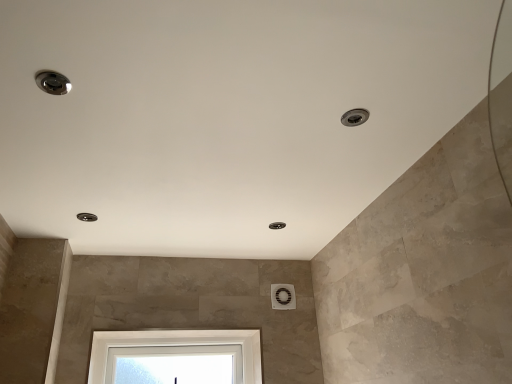
Question: Should I look upward or downward to see matte silver droplight at upper left, positioned as the 1th droplight in left-to-right order?

Choices:
 (A) up
 (B) down

Answer: (B)

Question: Is matte silver droplight at upper left, the 3th droplight viewed from the front, next to satin nickel droplight at upper left, the first droplight viewed from the top?

Choices:
 (A) yes
 (B) no

Answer: (B)

Question: Considering the relative sizes of matte silver droplight at upper left, positioned as the 1th droplight in left-to-right order, and satin nickel droplight at upper left, acting as the second droplight starting from the left, in the image provided, is matte silver droplight at upper left, positioned as the 1th droplight in left-to-right order, smaller than satin nickel droplight at upper left, acting as the second droplight starting from the left,?

Choices:
 (A) yes
 (B) no

Answer: (A)

Question: Can you confirm if matte silver droplight at upper left, positioned as the 1th droplight in left-to-right order, is positioned to the right of satin nickel droplight at upper left, acting as the 3th droplight starting from the back?

Choices:
 (A) no
 (B) yes

Answer: (A)

Question: From a real-world perspective, is matte silver droplight at upper left, which is the 3th droplight in right-to-left order, positioned over satin nickel droplight at upper left, the first droplight viewed from the front, based on gravity?

Choices:
 (A) yes
 (B) no

Answer: (A)

Question: From the image's perspective, does matte silver droplight at upper left, which is the 3th droplight in right-to-left order, appear lower than satin nickel droplight at upper left, the 2th droplight positioned from the right?

Choices:
 (A) no
 (B) yes

Answer: (B)

Question: Could you tell me if matte silver droplight at upper left, the 1th droplight from the back, is facing satin nickel droplight at upper left, acting as the second droplight starting from the left?

Choices:
 (A) no
 (B) yes

Answer: (B)

Question: Can you confirm if satin nickel droplight at upper left, the first droplight viewed from the top, is positioned to the left of matte silver droplight at upper left, the 1th droplight ordered from the bottom?

Choices:
 (A) yes
 (B) no

Answer: (B)

Question: From the image's perspective, is satin nickel droplight at upper left, placed as the third droplight when sorted from bottom to top, below matte silver droplight at upper left, the 3th droplight in the top-to-bottom sequence?

Choices:
 (A) yes
 (B) no

Answer: (B)

Question: Is satin nickel droplight at upper left, the first droplight viewed from the front, smaller than matte silver droplight at upper left, the 1th droplight ordered from the bottom?

Choices:
 (A) yes
 (B) no

Answer: (B)

Question: Can you confirm if satin nickel droplight at upper left, placed as the third droplight when sorted from bottom to top, is positioned to the right of matte silver droplight at upper left, the 3th droplight in the top-to-bottom sequence?

Choices:
 (A) no
 (B) yes

Answer: (B)

Question: Is satin nickel droplight at upper left, the first droplight viewed from the top, bigger than matte silver droplight at upper left, the 3th droplight viewed from the front?

Choices:
 (A) no
 (B) yes

Answer: (B)

Question: Could matte silver droplight at upper left, positioned as the 1th droplight in left-to-right order, be considered to be inside satin nickel droplight at upper left, placed as the third droplight when sorted from bottom to top?

Choices:
 (A) no
 (B) yes

Answer: (A)

Question: Is matte silver droplight at upper left, positioned as the 1th droplight in left-to-right order, in contact with satin nickel droplight at upper right, which appears as the second droplight when viewed from the back?

Choices:
 (A) yes
 (B) no

Answer: (B)